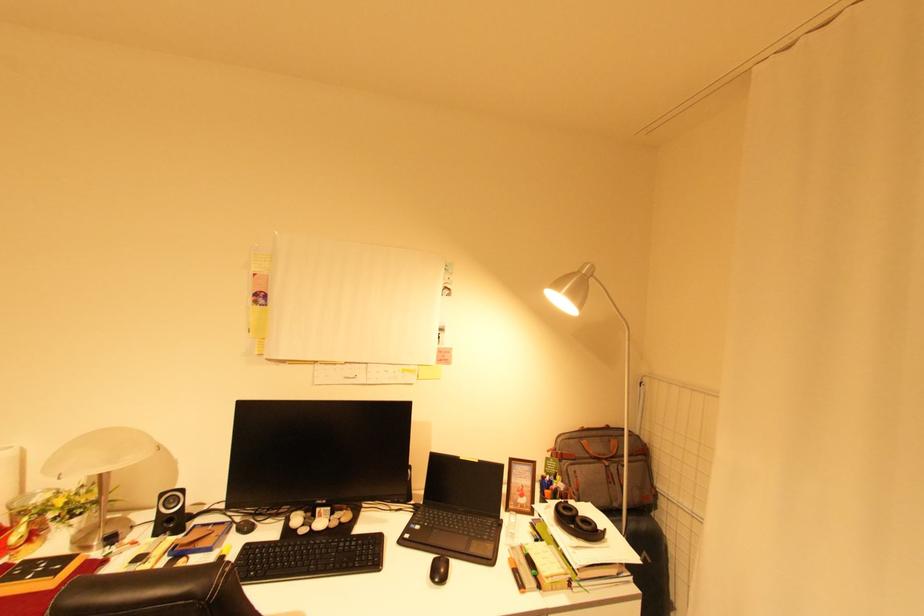
Identify the location of black headphones. (577, 523).